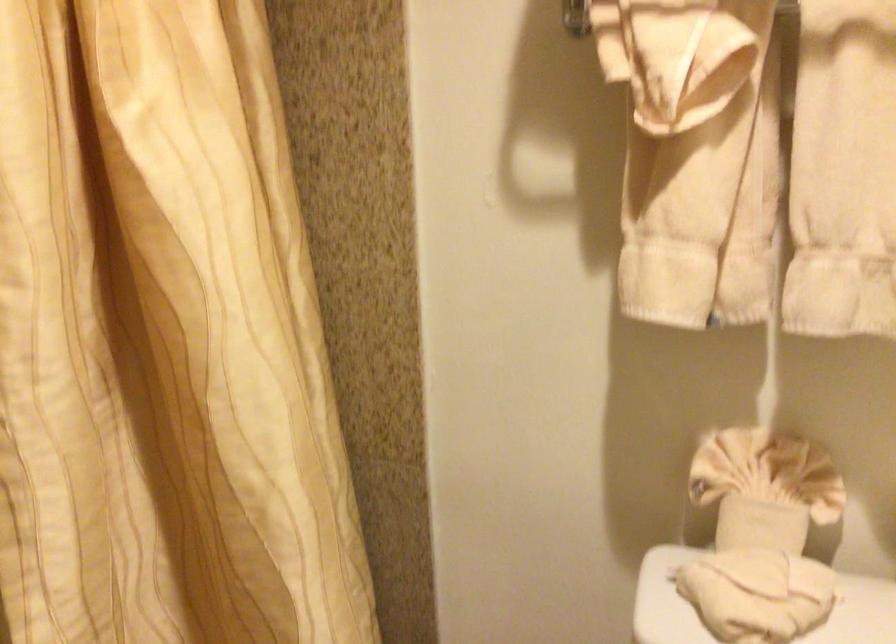
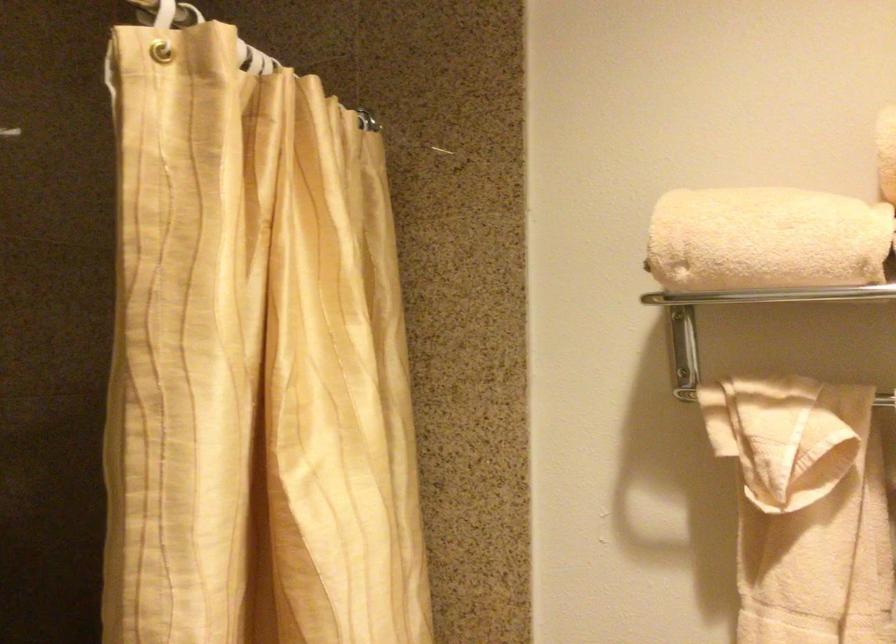
Question: The first image is from the beginning of the video and the second image is from the end. How did the camera likely rotate when shooting the video?

Choices:
 (A) Left
 (B) Right
 (C) Up
 (D) Down

Answer: (C)